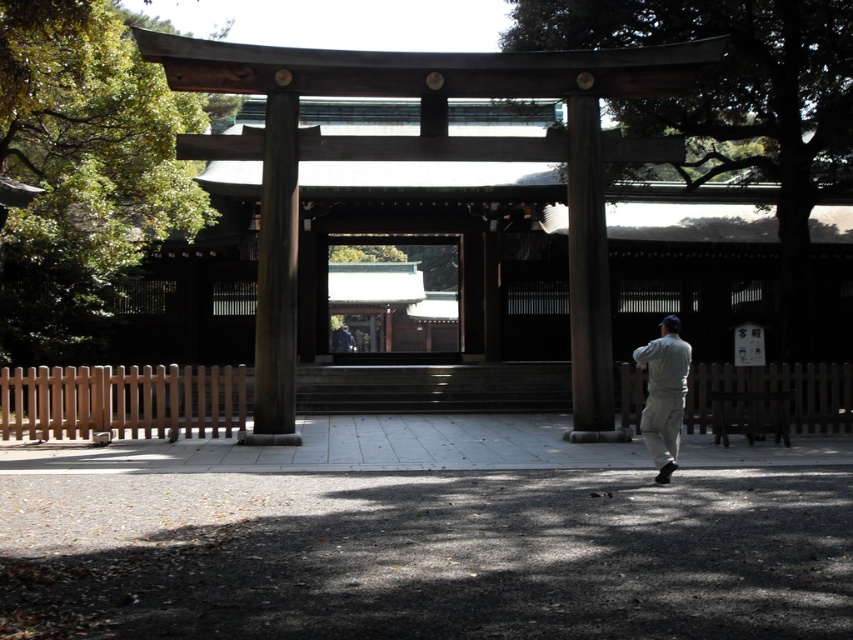
How distant is smooth brown pillar at center from smooth wood pillar at center?

smooth brown pillar at center is 15.04 feet from smooth wood pillar at center.

Does smooth brown pillar at center appear under smooth wood pillar at center?

Actually, smooth brown pillar at center is above smooth wood pillar at center.

Does point (264, 122) come farther from viewer compared to point (596, 294)?

Yes, point (264, 122) is behind point (596, 294).

Locate an element on the screen. The height and width of the screenshot is (640, 853). smooth brown pillar at center is located at coordinates (276, 276).

Looking at this image, can you confirm if smooth wood pillar at center is positioned below gray fabric pants at right?

Actually, smooth wood pillar at center is above gray fabric pants at right.

Can you confirm if smooth wood pillar at center is bigger than gray fabric pants at right?

Indeed, smooth wood pillar at center has a larger size compared to gray fabric pants at right.

Is point (581, 337) farther from viewer compared to point (660, 394)?

Yes, point (581, 337) is farther from viewer.

At what (x,y) coordinates should I click in order to perform the action: click on smooth wood pillar at center. Please return your answer as a coordinate pair (x, y). Looking at the image, I should click on (589, 278).

Which is below, gray fabric pants at right or matte gray jacket at center?

matte gray jacket at center

Does gray fabric pants at right appear on the right side of matte gray jacket at center?

Yes, gray fabric pants at right is to the right of matte gray jacket at center.

Is point (663, 436) positioned in front of point (347, 339)?

Yes, point (663, 436) is in front of point (347, 339).

You are a GUI agent. You are given a task and a screenshot of the screen. Output one action in this format:
    pyautogui.click(x=<x>, y=<y>)
    Task: Click on the gray fabric pants at right
    
    Given the screenshot: What is the action you would take?
    pyautogui.click(x=664, y=394)